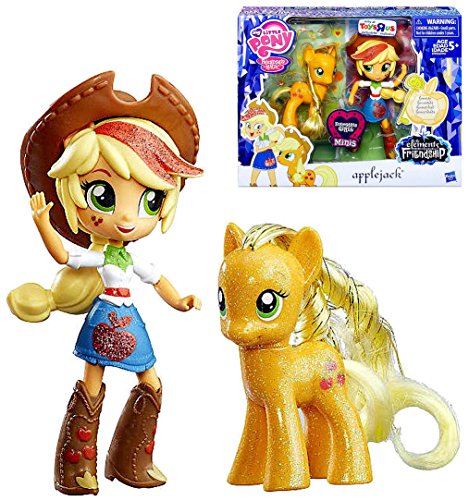
Where is `my little pony figurine`? my little pony figurine is located at coordinates tap(324, 72), tap(276, 349).